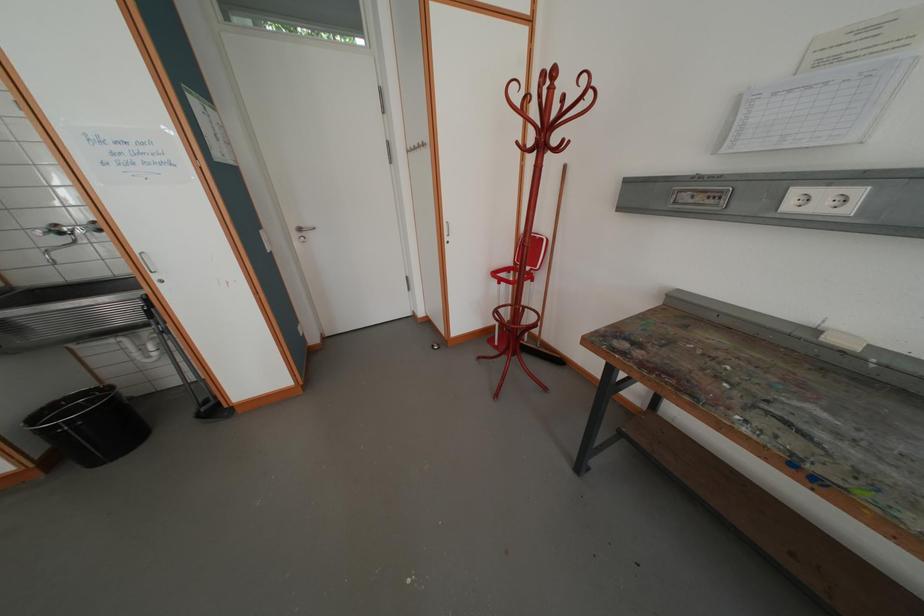
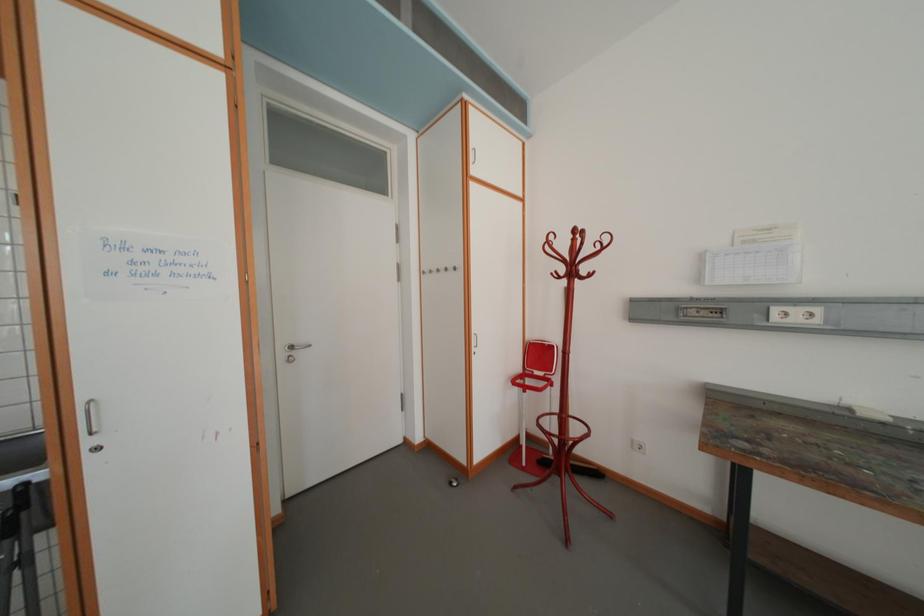
Based on the continuous images, in which direction is the camera rotating?

The camera's rotation is toward right-up.